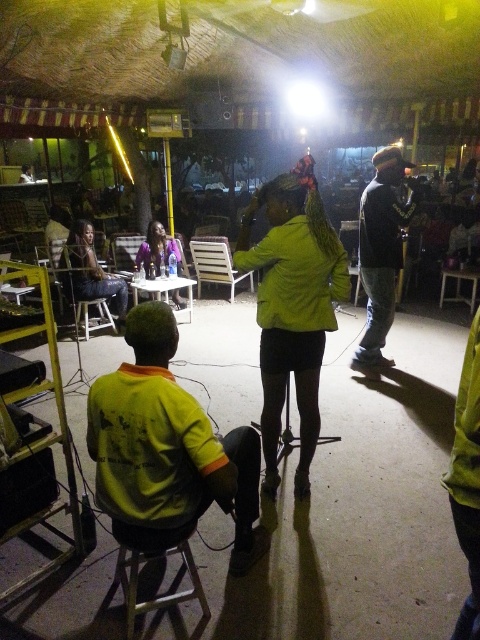
You are a photographer setting up a shot of the nighttime gathering. To ensure the matte black jacket at left and the metallic stool at lower left are both in focus, which object should you place closer to the camera?

The matte black jacket at left is positioned over the metallic stool at lower left, so you should place the metallic stool at lower left closer to the camera to ensure both are in focus.

You are organizing a photo shoot and need to ensure that the clothing items in the scene are appropriately sized for the models. Given that the yellow fabric shirt at lower left and the matte black jacket at left are both part of the outfit, which clothing item has a greater width?

The yellow fabric shirt at lower left has a greater width than the matte black jacket at left according to the description.